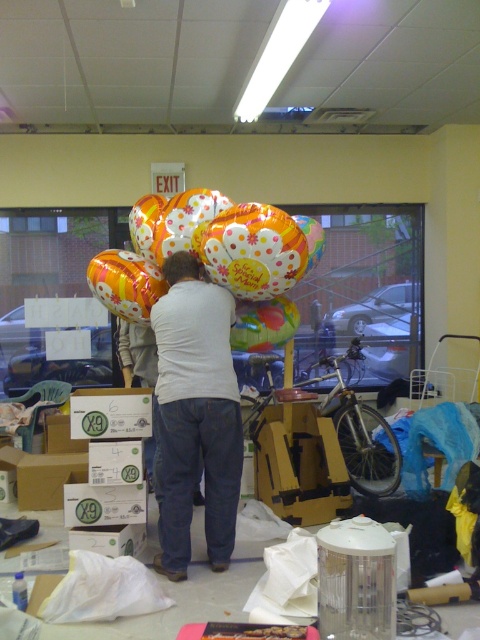
From the picture: Can you confirm if metallic gold balloon at upper center is positioned to the right of white cardboard box at lower left?

Correct, you'll find metallic gold balloon at upper center to the right of white cardboard box at lower left.

Between metallic gold balloon at upper center and white cardboard box at lower left, which one is positioned lower?

white cardboard box at lower left is lower down.

Between point (127, 307) and point (45, 483), which one is positioned behind?

Point (45, 483)

Identify the location of metallic gold balloon at upper center. The image size is (480, 640). click(126, 284).

Does white cotton shirt at center have a smaller size compared to floral-patterned balloon at center?

Incorrect, white cotton shirt at center is not smaller in size than floral-patterned balloon at center.

The image size is (480, 640). I want to click on white cotton shirt at center, so click(194, 416).

Looking at this image, which is below, white cotton shirt at center or metallic gold balloon at upper center?

white cotton shirt at center is below.

Does point (181, 385) lie behind point (129, 317)?

No, (181, 385) is in front of (129, 317).

Where is `white cotton shirt at center`? The width and height of the screenshot is (480, 640). white cotton shirt at center is located at coordinates pos(194,416).